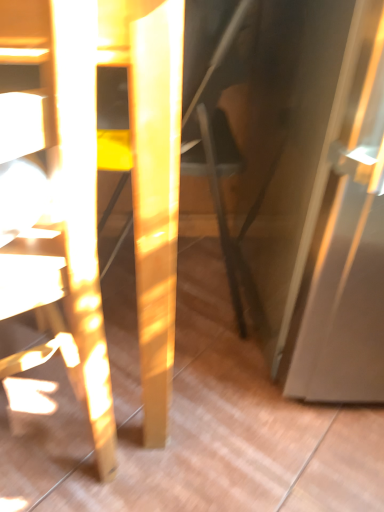
Question: Is matte black swivel chair at center to the left or to the right of matte yellow chair at left in the image?

Choices:
 (A) left
 (B) right

Answer: (B)

Question: Based on their sizes in the image, would you say matte black swivel chair at center is bigger or smaller than matte yellow chair at left?

Choices:
 (A) big
 (B) small

Answer: (B)

Question: Considering their positions, is matte black swivel chair at center located in front of or behind matte yellow chair at left?

Choices:
 (A) behind
 (B) front

Answer: (A)

Question: From the image's perspective, is matte yellow chair at left positioned above or below matte black swivel chair at center?

Choices:
 (A) above
 (B) below

Answer: (B)

Question: Looking at the image, does matte yellow chair at left seem bigger or smaller compared to matte black swivel chair at center?

Choices:
 (A) big
 (B) small

Answer: (A)

Question: Is matte yellow chair at left inside the boundaries of matte black swivel chair at center, or outside?

Choices:
 (A) outside
 (B) inside

Answer: (A)

Question: Does point (59, 75) appear closer or farther from the camera than point (231, 29)?

Choices:
 (A) closer
 (B) farther

Answer: (A)